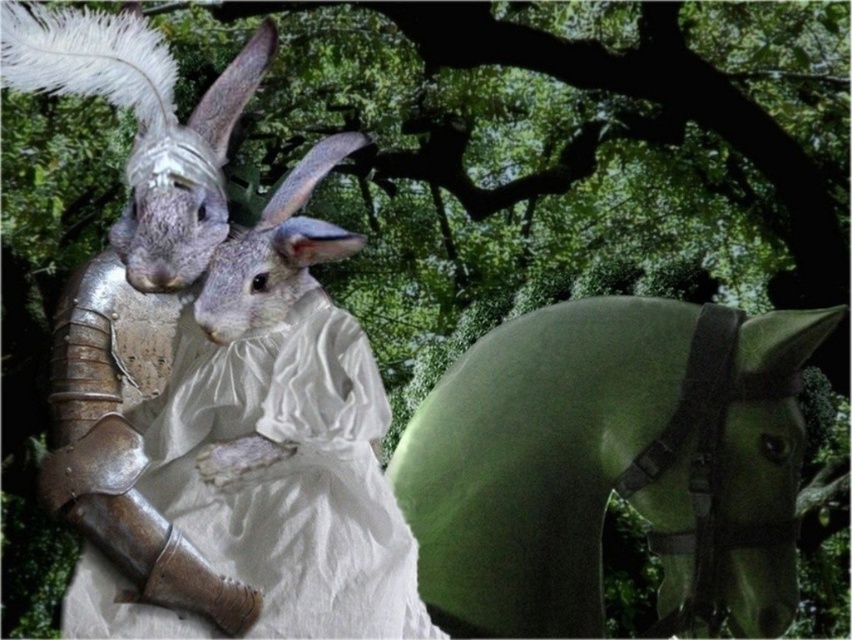
Question: Is green felt horse at right in front of white satin dress at center?

Choices:
 (A) no
 (B) yes

Answer: (A)

Question: Does green felt horse at right lie in front of white satin dress at center?

Choices:
 (A) yes
 (B) no

Answer: (B)

Question: Does green felt horse at right appear on the right side of white satin dress at center?

Choices:
 (A) no
 (B) yes

Answer: (B)

Question: Which point is closer to the camera?

Choices:
 (A) white satin dress at center
 (B) green felt horse at right

Answer: (A)